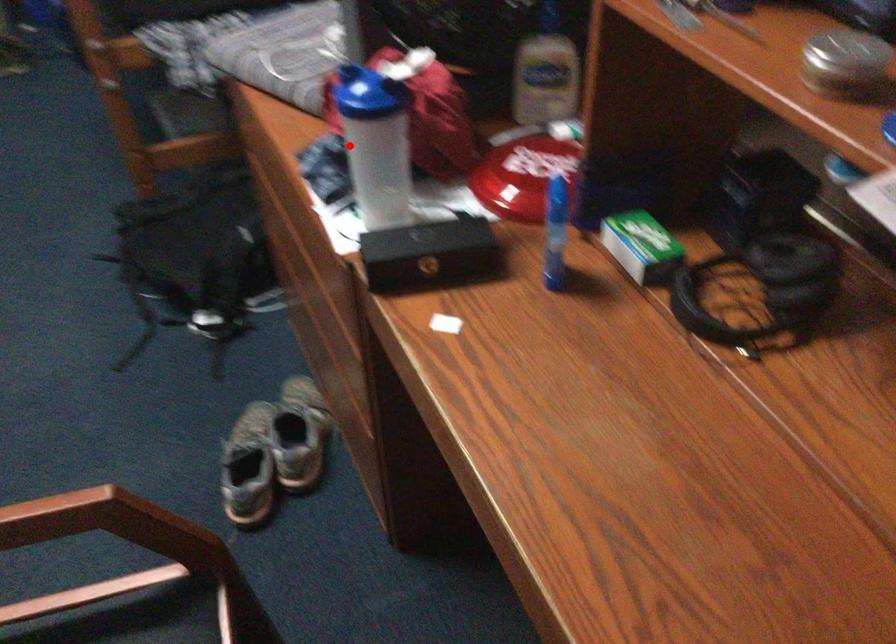
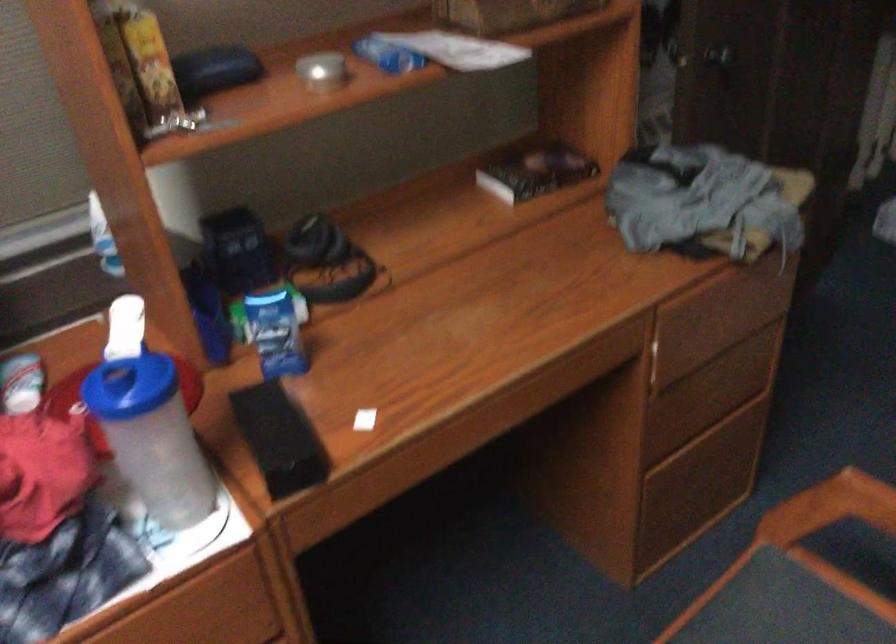
Where in the second image is the point corresponding to the highlighted location from the first image?

(151, 437)